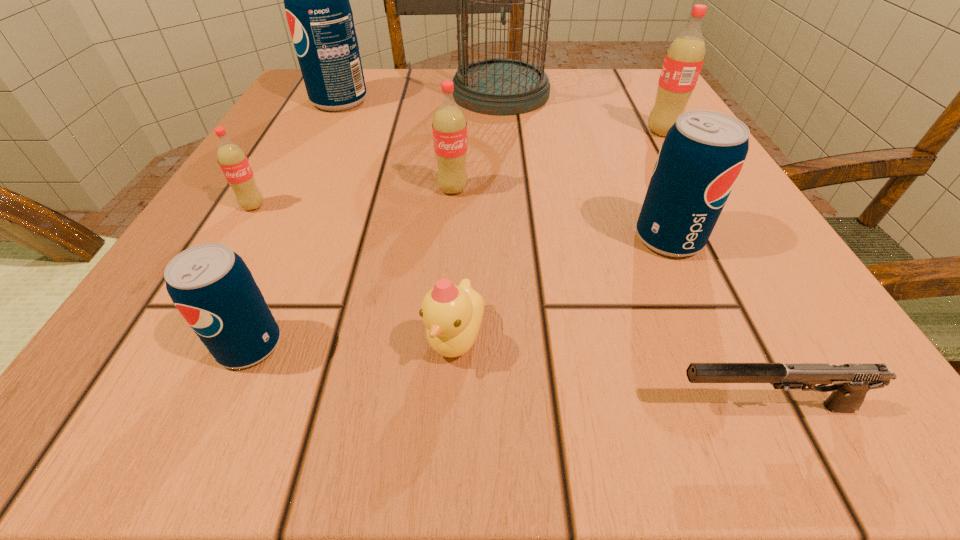
Identify the location of the nearest soda. (211, 286).

Where is `the nearest red soda`? This screenshot has width=960, height=540. the nearest red soda is located at coordinates (234, 163).

This screenshot has width=960, height=540. I want to click on the fifth nearest object, so click(234, 163).

Image resolution: width=960 pixels, height=540 pixels. I want to click on duckling, so click(452, 314).

This screenshot has height=540, width=960. I want to click on the eighth tallest object, so click(452, 314).

Locate an element on the screen. The height and width of the screenshot is (540, 960). gray gun is located at coordinates tap(851, 382).

Find the location of a particular element. the nearest object is located at coordinates (851, 382).

Where is `free location located 0.220m on the front-facing side of the tallest object`? free location located 0.220m on the front-facing side of the tallest object is located at coordinates (341, 93).

The height and width of the screenshot is (540, 960). I want to click on vacant space located on the front-facing side of the tallest object, so click(426, 93).

I want to click on vacant area located on the front-facing side of the tallest object, so click(x=341, y=93).